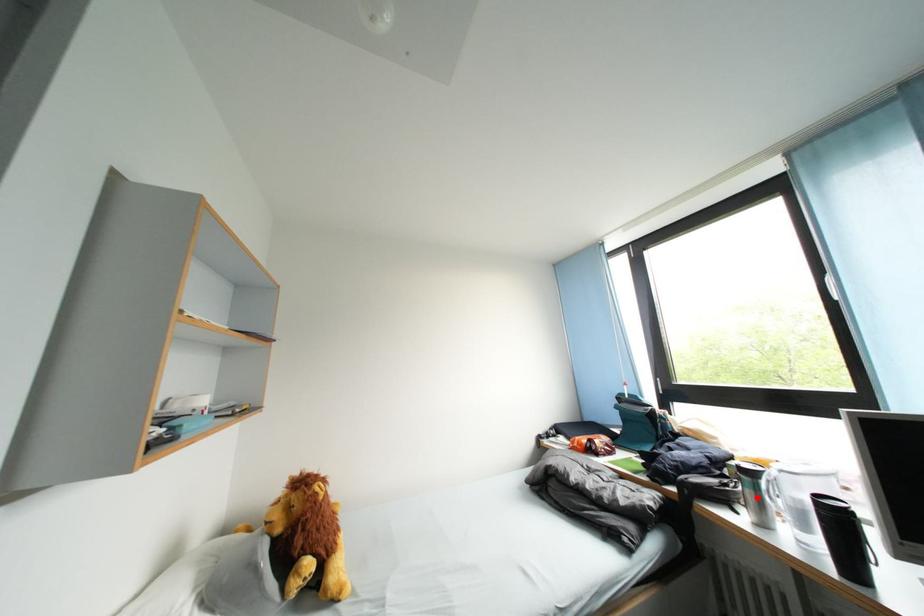
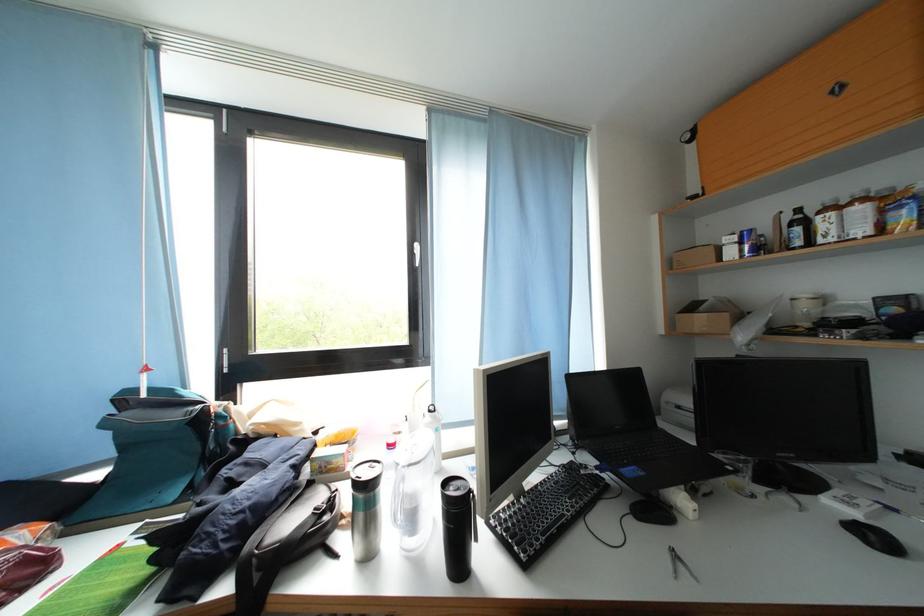
In the second image, find the point that corresponds to the highlighted location in the first image.

(369, 521)